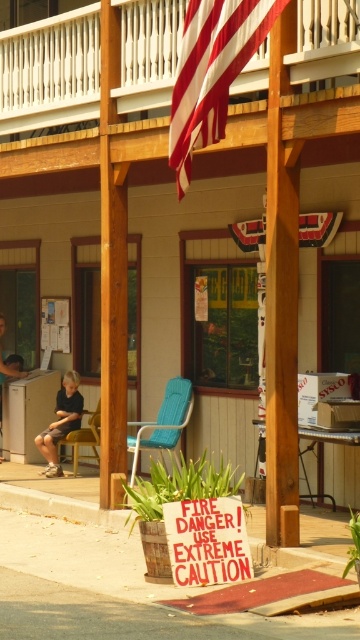
Between point (52, 449) and point (0, 397), which one is positioned in front?

Point (52, 449) is more forward.

Image resolution: width=360 pixels, height=640 pixels. What do you see at coordinates (60, 422) in the screenshot? I see `dark brown leather shorts at lower left` at bounding box center [60, 422].

What do you see at coordinates (60, 422) in the screenshot? I see `dark brown leather shorts at lower left` at bounding box center [60, 422].

At what (x,y) coordinates should I click in order to perform the action: click on dark brown leather shorts at lower left. Please return your answer as a coordinate pair (x, y). The width and height of the screenshot is (360, 640). Looking at the image, I should click on (60, 422).

Which is more to the right, dark brown leather shorts at lower left or yellow fabric chair at left?

Positioned to the right is yellow fabric chair at left.

Between point (54, 432) and point (88, 445), which one is positioned behind?

The point (88, 445) is more distant.

This screenshot has height=640, width=360. Identify the location of dark brown leather shorts at lower left. 60,422.

Describe the element at coordinates (212, 72) in the screenshot. This screenshot has height=640, width=360. I see `red-white striped flag at upper center` at that location.

Does point (253, 12) lie behind point (2, 321)?

No, it is in front of (2, 321).

Where is `red-white striped flag at upper center`? red-white striped flag at upper center is located at coordinates (212, 72).